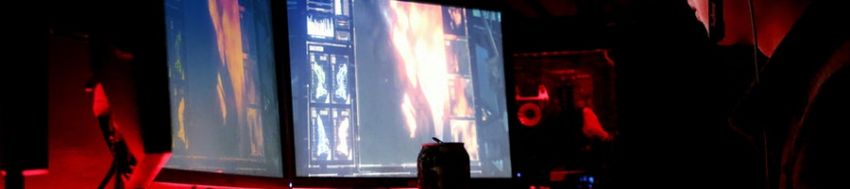
The width and height of the screenshot is (850, 189). Find the location of `screen`. screen is located at coordinates (409, 73).